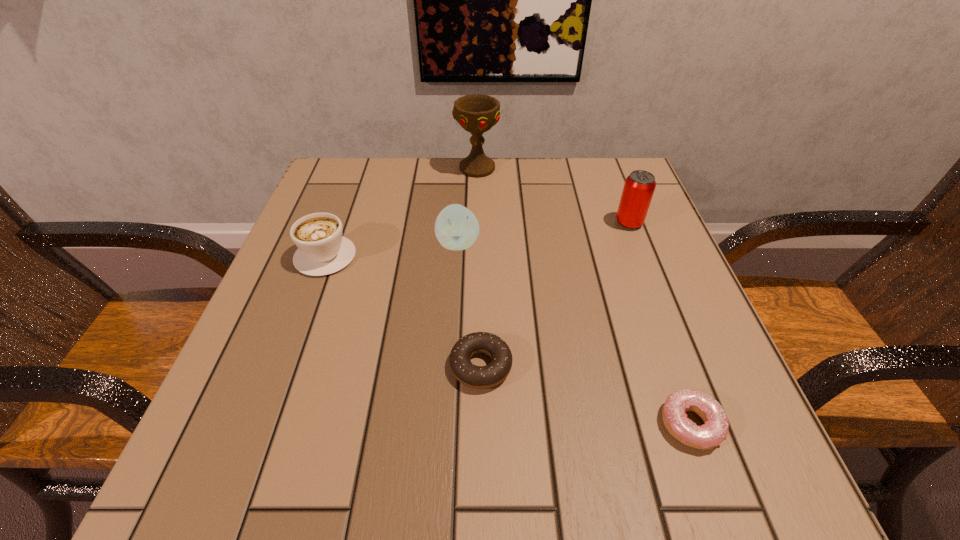
The height and width of the screenshot is (540, 960). What are the coordinates of `free space between the right doughnut and the cappuccino` in the screenshot? It's located at (x=508, y=340).

I want to click on unoccupied position between the can and the chalice, so click(x=553, y=195).

Select which object is the fourth closest to the nearer doughnut. Please provide its 2D coordinates. Your answer should be formatted as a tuple, i.e. [(x, y)], where the tuple contains the x and y coordinates of a point satisfying the conditions above.

[(322, 250)]

The width and height of the screenshot is (960, 540). I want to click on object that is the fifth closest one to the fifth shortest object, so click(x=322, y=250).

Where is `free region that satisfies the following two spatial constraints: 1. on the back side of the nearest object; 2. on the right side of the second tallest object`? free region that satisfies the following two spatial constraints: 1. on the back side of the nearest object; 2. on the right side of the second tallest object is located at coordinates (618, 223).

Locate an element on the screen. This screenshot has width=960, height=540. vacant space that satisfies the following two spatial constraints: 1. to the right of the leftmost object's handle; 2. on the right side of the tallest object is located at coordinates (358, 168).

Where is `vacant space that satisfies the following two spatial constraints: 1. on the back side of the second tallest object; 2. on the left side of the right doughnut`? The image size is (960, 540). vacant space that satisfies the following two spatial constraints: 1. on the back side of the second tallest object; 2. on the left side of the right doughnut is located at coordinates (618, 223).